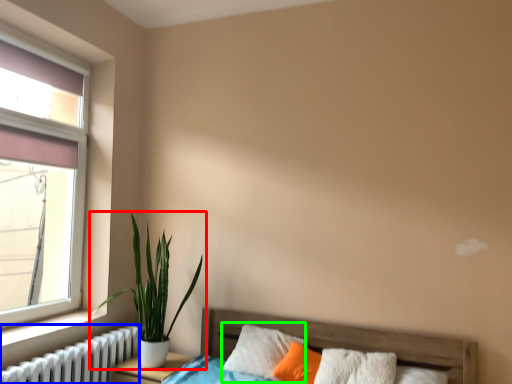
Question: Estimate the real-world distances between objects in this image. Which object is farther from houseplant (highlighted by a red box), radiator (highlighted by a blue box) or pillow (highlighted by a green box)?

Choices:
 (A) radiator
 (B) pillow

Answer: (B)